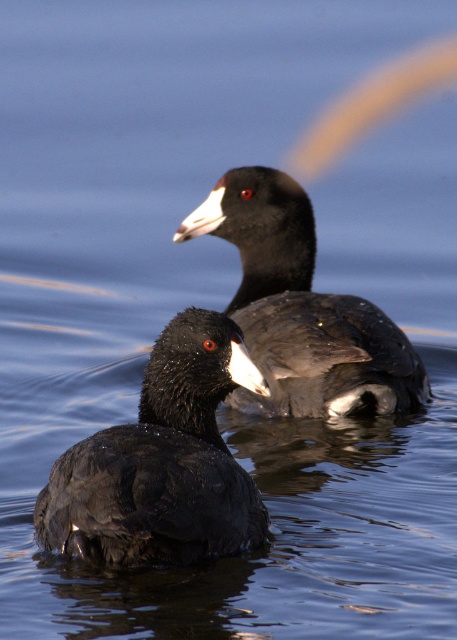
Question: Observing the image, what is the correct spatial positioning of black matte duck at center in reference to shiny black duck at center?

Choices:
 (A) above
 (B) below

Answer: (B)

Question: Is black matte duck at center in front of shiny black duck at center?

Choices:
 (A) no
 (B) yes

Answer: (B)

Question: Observing the image, what is the correct spatial positioning of black matte duck at center in reference to shiny black duck at center?

Choices:
 (A) above
 (B) below

Answer: (B)

Question: Which object appears closest to the camera in this image?

Choices:
 (A) black matte duck at center
 (B) shiny black duck at center

Answer: (A)

Question: Which of the following is the closest to the observer?

Choices:
 (A) (161, 502)
 (B) (282, 232)

Answer: (A)